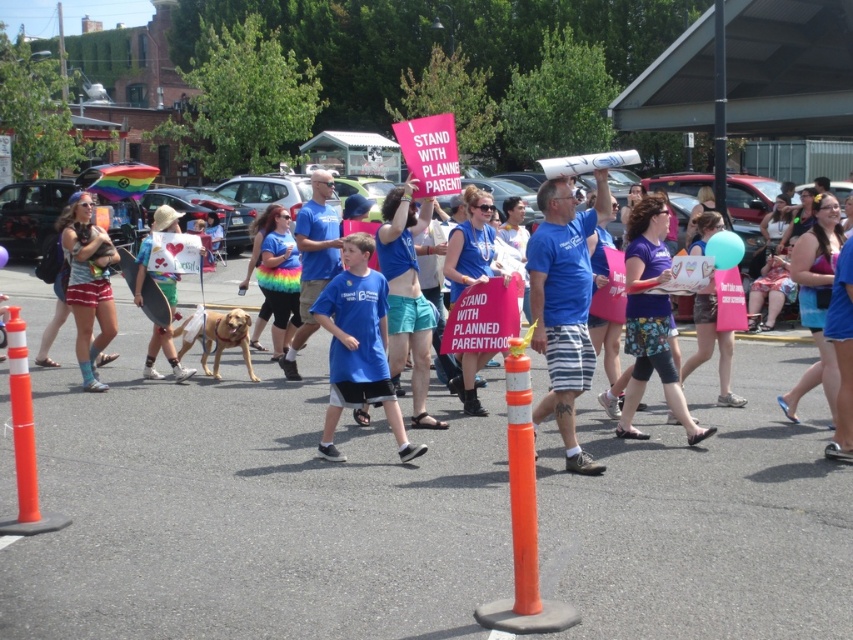
You are a photographer trying to capture the protest scene. You notice the blue cotton shirt at center and the orange plastic traffic cone at lower left. Which object should you focus on if you want to photograph the larger object?

The blue cotton shirt at center is bigger than the orange plastic traffic cone at lower left, so you should focus on the blue cotton shirt at center to capture the larger object.